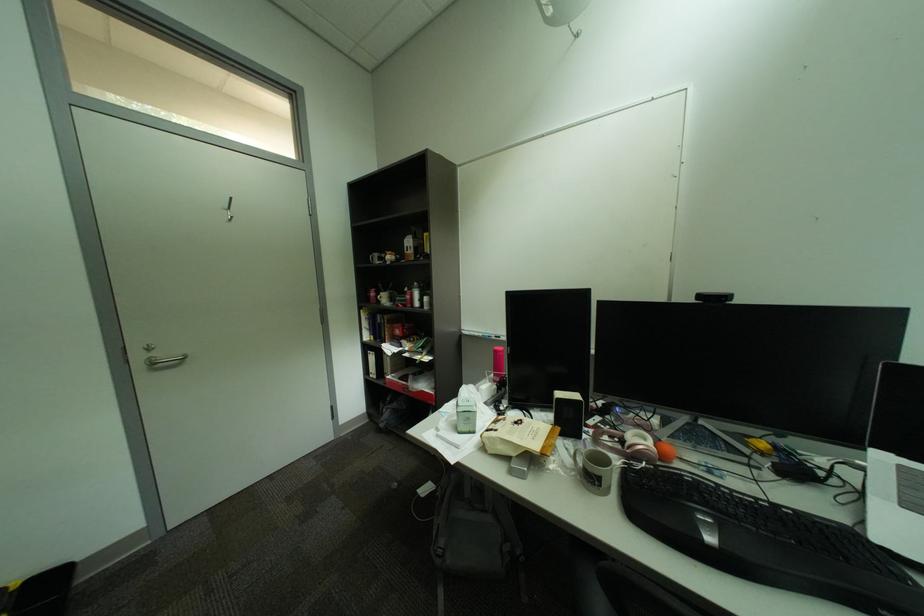
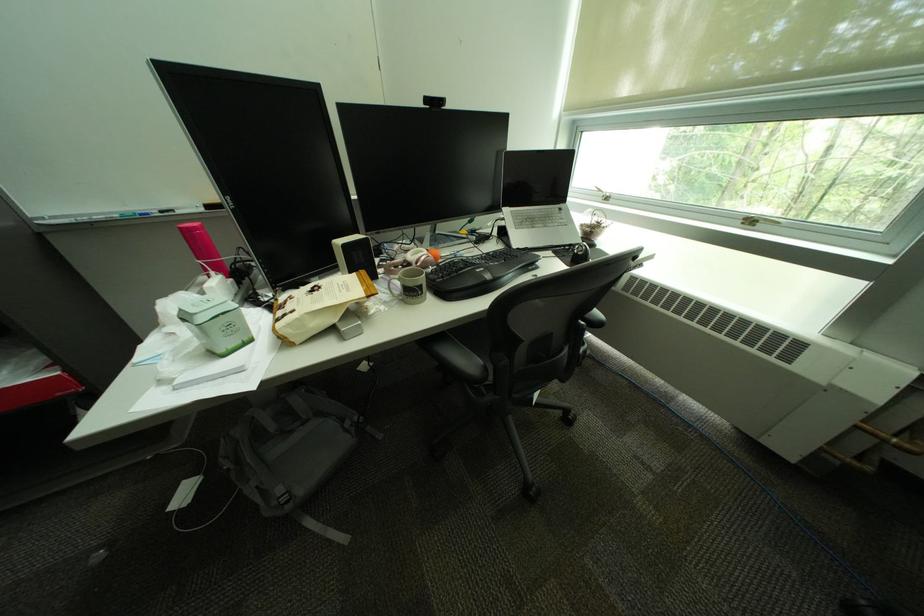
Find the pixel in the second image that matches (x=871, y=464) in the first image.

(514, 217)